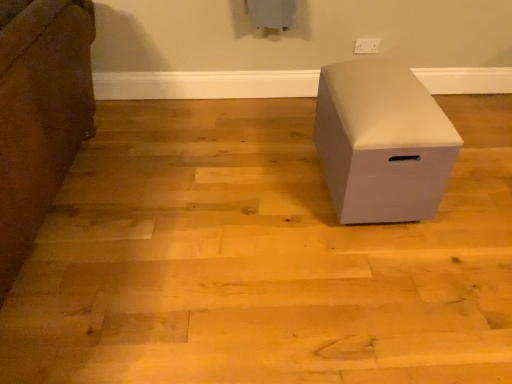
The image size is (512, 384). Describe the element at coordinates (382, 142) in the screenshot. I see `white matte storage box at center, positioned as the first furniture in right-to-left order` at that location.

You are a GUI agent. You are given a task and a screenshot of the screen. Output one action in this format:
    pyautogui.click(x=<x>, y=<y>)
    Task: Click on the white matte storage box at center, which is the second furniture in right-to-left order
    Image resolution: width=512 pixels, height=384 pixels.
    Given the screenshot: What is the action you would take?
    pyautogui.click(x=40, y=114)

Which object is further away from the camera, white plastic electric outlet at upper center or white matte storage box at center, which is the second furniture in right-to-left order?

Positioned behind is white plastic electric outlet at upper center.

Is white plastic electric outlet at upper center oriented away from white matte storage box at center, which is the 1th furniture from left to right?

No, white plastic electric outlet at upper center is not facing away from white matte storage box at center, which is the 1th furniture from left to right.

From the image's perspective, is white plastic electric outlet at upper center located above or below white matte storage box at center, which is the 1th furniture from left to right?

From the image's perspective, white plastic electric outlet at upper center appears above white matte storage box at center, which is the 1th furniture from left to right.

Is white matte storage box at center, the 2th furniture in the left-to-right sequence, inside white plastic electric outlet at upper center?

No, white matte storage box at center, the 2th furniture in the left-to-right sequence, is located outside of white plastic electric outlet at upper center.

I want to click on electric outlet above the white matte storage box at center, positioned as the first furniture in right-to-left order (from a real-world perspective), so click(367, 45).

Looking at the image, does white plastic electric outlet at upper center seem bigger or smaller compared to white matte storage box at center, positioned as the first furniture in right-to-left order?

Clearly, white plastic electric outlet at upper center is smaller in size than white matte storage box at center, positioned as the first furniture in right-to-left order.

From the image's perspective, relative to white matte storage box at center, positioned as the first furniture in right-to-left order, is white plastic electric outlet at upper center above or below?

Clearly, from the image's perspective, white plastic electric outlet at upper center is above white matte storage box at center, positioned as the first furniture in right-to-left order.

Visually, is white matte storage box at center, which is the 1th furniture from left to right, positioned to the left or to the right of white matte storage box at center, positioned as the first furniture in right-to-left order?

From the image, it's evident that white matte storage box at center, which is the 1th furniture from left to right, is to the left of white matte storage box at center, positioned as the first furniture in right-to-left order.

Does point (8, 40) lie behind point (379, 73)?

No, (8, 40) is in front of (379, 73).

From the image's perspective, is white matte storage box at center, which is the second furniture in right-to-left order, located above or below white matte storage box at center, the 2th furniture in the left-to-right sequence?

Clearly, from the image's perspective, white matte storage box at center, which is the second furniture in right-to-left order, is above white matte storage box at center, the 2th furniture in the left-to-right sequence.

Is white matte storage box at center, which is the 1th furniture from left to right, directly adjacent to white matte storage box at center, positioned as the first furniture in right-to-left order?

No, white matte storage box at center, which is the 1th furniture from left to right, is not next to white matte storage box at center, positioned as the first furniture in right-to-left order.

Image resolution: width=512 pixels, height=384 pixels. What are the coordinates of `electric outlet below the white matte storage box at center, which is the second furniture in right-to-left order (from a real-world perspective)` in the screenshot? It's located at (367, 45).

Would you say white plastic electric outlet at upper center is part of white matte storage box at center, which is the second furniture in right-to-left order,'s contents?

No, white plastic electric outlet at upper center is not inside white matte storage box at center, which is the second furniture in right-to-left order.

Is point (58, 115) more distant than point (368, 44)?

No, (58, 115) is in front of (368, 44).

How many degrees apart are the facing directions of white matte storage box at center, which is the second furniture in right-to-left order, and white plastic electric outlet at upper center?

The angular difference between white matte storage box at center, which is the second furniture in right-to-left order, and white plastic electric outlet at upper center is 91.8 degrees.

Is white matte storage box at center, the 2th furniture in the left-to-right sequence, in front of white plastic electric outlet at upper center?

Yes, it is in front of white plastic electric outlet at upper center.

Is white matte storage box at center, positioned as the first furniture in right-to-left order, at the left side of white plastic electric outlet at upper center?

Yes, white matte storage box at center, positioned as the first furniture in right-to-left order, is to the left of white plastic electric outlet at upper center.

In the scene shown: From a real-world perspective, relative to white plastic electric outlet at upper center, is white matte storage box at center, the 2th furniture in the left-to-right sequence, vertically above or below?

Clearly, from a real-world perspective, white matte storage box at center, the 2th furniture in the left-to-right sequence, is below white plastic electric outlet at upper center.

In terms of size, does white matte storage box at center, the 2th furniture in the left-to-right sequence, appear bigger or smaller than white plastic electric outlet at upper center?

Considering their sizes, white matte storage box at center, the 2th furniture in the left-to-right sequence, takes up more space than white plastic electric outlet at upper center.

From a real-world perspective, between white matte storage box at center, the 2th furniture in the left-to-right sequence, and white matte storage box at center, which is the 1th furniture from left to right, who is vertically higher?

white matte storage box at center, which is the 1th furniture from left to right.

Looking at this image, which of these two, white matte storage box at center, positioned as the first furniture in right-to-left order, or white matte storage box at center, which is the second furniture in right-to-left order, is thinner?

white matte storage box at center, positioned as the first furniture in right-to-left order, is thinner.

Does white matte storage box at center, the 2th furniture in the left-to-right sequence, contain white matte storage box at center, which is the second furniture in right-to-left order?

No, white matte storage box at center, which is the second furniture in right-to-left order, is not inside white matte storage box at center, the 2th furniture in the left-to-right sequence.

Which is more to the left, white matte storage box at center, positioned as the first furniture in right-to-left order, or white matte storage box at center, which is the 1th furniture from left to right?

white matte storage box at center, which is the 1th furniture from left to right.

The height and width of the screenshot is (384, 512). I want to click on electric outlet behind the white matte storage box at center, which is the second furniture in right-to-left order, so click(367, 45).

From the white plastic electric outlet at upper center, count 1st furnitures forward and point to it. Please provide its 2D coordinates.

[(382, 142)]

Considering their positions, is white plastic electric outlet at upper center positioned closer to white matte storage box at center, positioned as the first furniture in right-to-left order, than white matte storage box at center, which is the 1th furniture from left to right?

Based on the image, white plastic electric outlet at upper center appears to be nearer to white matte storage box at center, positioned as the first furniture in right-to-left order.

From the image, which object appears to be farther from white plastic electric outlet at upper center, white matte storage box at center, positioned as the first furniture in right-to-left order, or white matte storage box at center, which is the 1th furniture from left to right?

white matte storage box at center, which is the 1th furniture from left to right, lies further to white plastic electric outlet at upper center than the other object.

From the image, which object appears to be nearer to white matte storage box at center, positioned as the first furniture in right-to-left order, white matte storage box at center, which is the 1th furniture from left to right, or white plastic electric outlet at upper center?

white plastic electric outlet at upper center is positioned closer to the anchor white matte storage box at center, positioned as the first furniture in right-to-left order.

When comparing their distances from white plastic electric outlet at upper center, does white matte storage box at center, which is the 1th furniture from left to right, or white matte storage box at center, the 2th furniture in the left-to-right sequence, seem closer?

The object closer to white plastic electric outlet at upper center is white matte storage box at center, the 2th furniture in the left-to-right sequence.

Looking at the image, which one is located closer to white matte storage box at center, which is the 1th furniture from left to right, white matte storage box at center, positioned as the first furniture in right-to-left order, or white plastic electric outlet at upper center?

white matte storage box at center, positioned as the first furniture in right-to-left order, is closer to white matte storage box at center, which is the 1th furniture from left to right.

Considering their positions, is white plastic electric outlet at upper center positioned further to white matte storage box at center, which is the second furniture in right-to-left order, than white matte storage box at center, the 2th furniture in the left-to-right sequence?

white plastic electric outlet at upper center lies further to white matte storage box at center, which is the second furniture in right-to-left order, than the other object.

In order to click on furniture located between white matte storage box at center, which is the 1th furniture from left to right, and white plastic electric outlet at upper center in the left-right direction in this screenshot , I will do `click(382, 142)`.